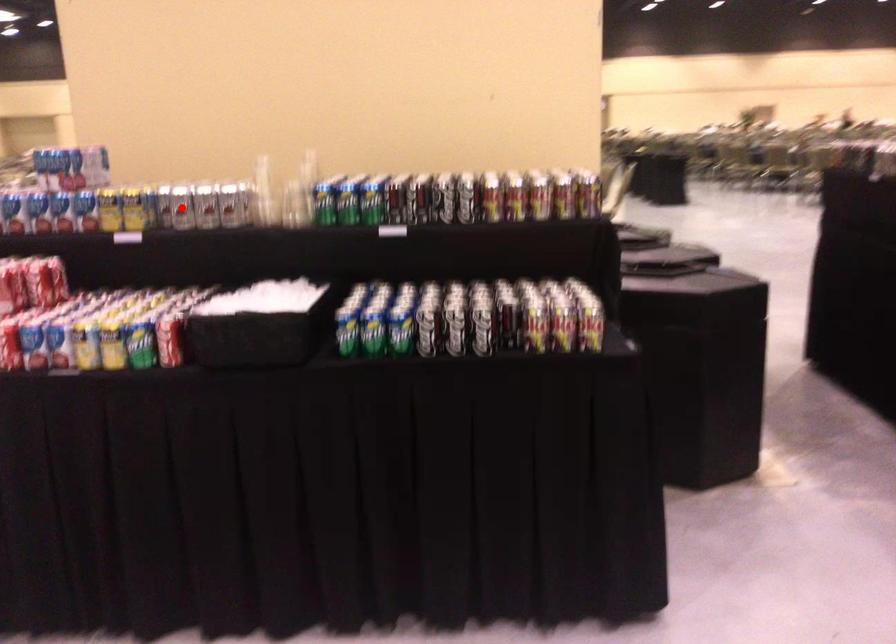
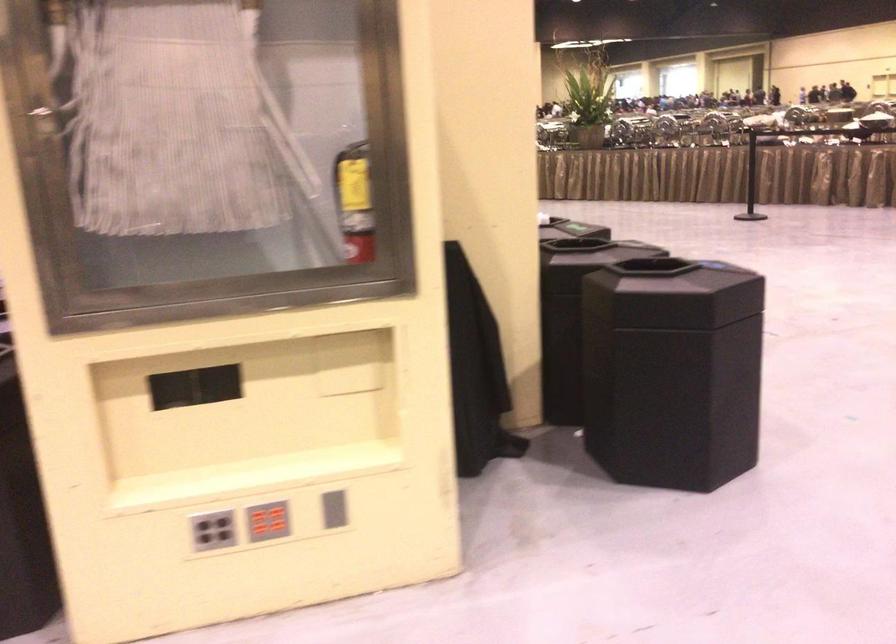
Question: I am providing you with two images of the same scene from different viewpoints. A red point is marked on the first image. Is the red point's position out of view in image 2?

Choices:
 (A) Yes
 (B) No

Answer: (A)